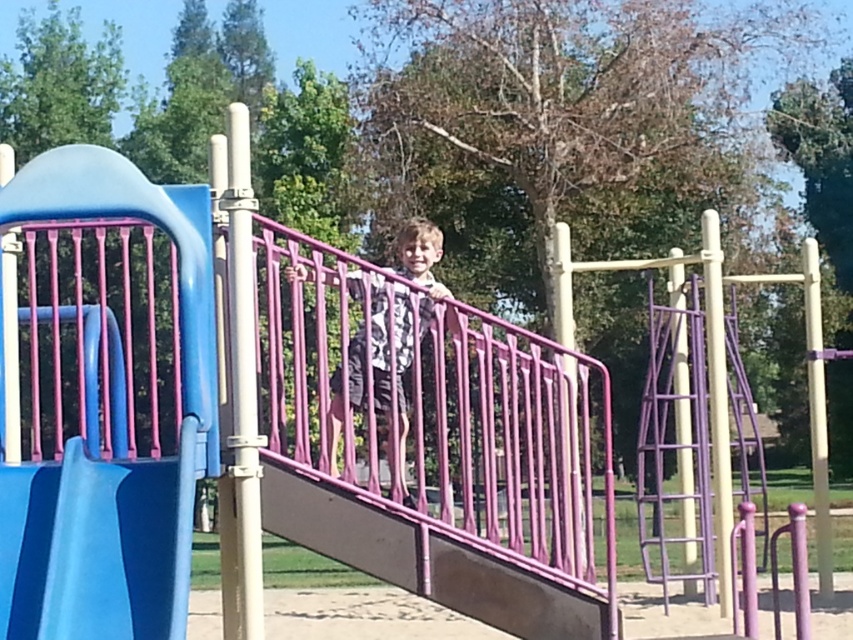
Question: Does smooth plastic slide at left lie in front of matte pink railing at center?

Choices:
 (A) yes
 (B) no

Answer: (A)

Question: Observing the image, what is the correct spatial positioning of smooth plastic slide at left in reference to matte pink railing at center?

Choices:
 (A) above
 (B) below

Answer: (B)

Question: Which of the following is the farthest from the observer?

Choices:
 (A) (184, 604)
 (B) (364, 400)

Answer: (B)

Question: Which point is farther to the camera?

Choices:
 (A) matte pink railing at center
 (B) smooth plastic slide at left

Answer: (A)

Question: Can you confirm if smooth plastic slide at left is wider than matte pink railing at center?

Choices:
 (A) no
 (B) yes

Answer: (B)